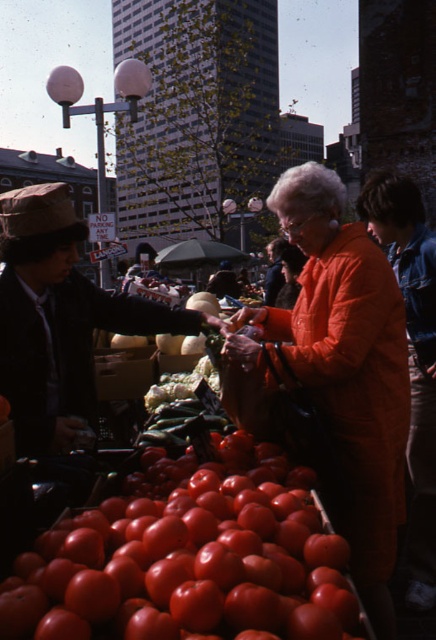
Question: Which is nearer to the matte black jacket at left?

Choices:
 (A) green leafy lettuce at center
 (B) glossy red tomato at lower center
 (C) orange fabric jacket at center

Answer: (A)

Question: Among these objects, which one is farthest from the camera?

Choices:
 (A) green leafy lettuce at center
 (B) matte black jacket at left

Answer: (A)

Question: Can you confirm if glossy red tomato at lower center is thinner than green leafy lettuce at center?

Choices:
 (A) no
 (B) yes

Answer: (A)

Question: Does glossy red tomato at lower center appear on the right side of green leafy lettuce at center?

Choices:
 (A) yes
 (B) no

Answer: (A)

Question: Among these objects, which one is nearest to the camera?

Choices:
 (A) matte black jacket at left
 (B) orange fabric jacket at center
 (C) green leafy lettuce at center
 (D) glossy red tomato at lower center

Answer: (D)

Question: Can you confirm if matte black jacket at left is positioned below green leafy lettuce at center?

Choices:
 (A) no
 (B) yes

Answer: (A)